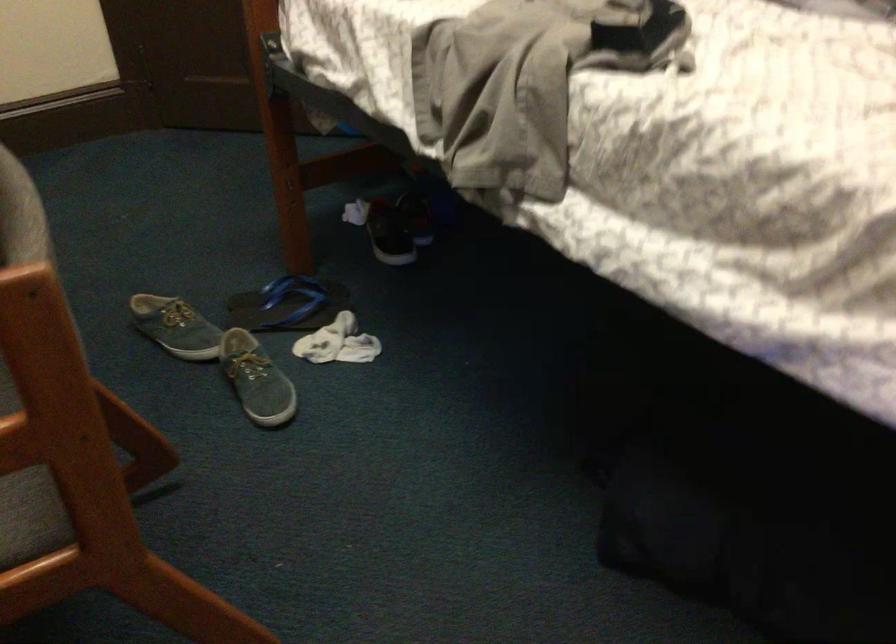
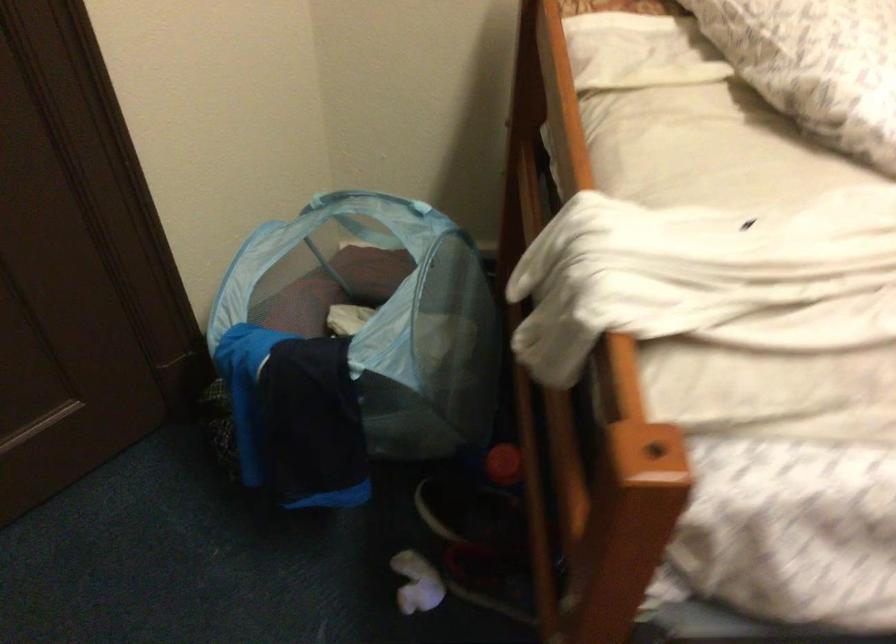
Find the pixel in the second image that matches (349,204) in the first image.

(417, 583)